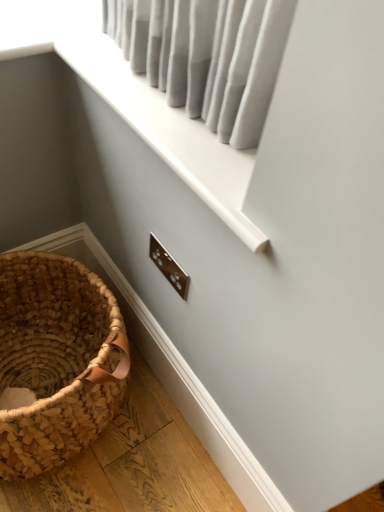
Image resolution: width=384 pixels, height=512 pixels. Describe the element at coordinates (166, 129) in the screenshot. I see `white plastic window frame at upper center` at that location.

Find the location of a particular element. white plastic window frame at upper center is located at coordinates (166, 129).

In order to face white plastic window frame at upper center, should I rotate leftwards or rightwards?

It's best to rotate left around 6.316 degrees.

Measure the distance between point (244,198) and camera.

Point (244,198) is 24.29 inches from camera.

The height and width of the screenshot is (512, 384). Identify the location of brown woven picnic basket at lower left. (56, 359).

In order to face brown woven picnic basket at lower left, should I rotate leftwards or rightwards?

Rotate left and turn 20.461 degrees.

What do you see at coordinates (56, 359) in the screenshot? I see `brown woven picnic basket at lower left` at bounding box center [56, 359].

The width and height of the screenshot is (384, 512). I want to click on white plastic window frame at upper center, so click(x=166, y=129).

Consider the image. Considering the relative positions of brown woven picnic basket at lower left and white plastic window frame at upper center in the image provided, is brown woven picnic basket at lower left to the right of white plastic window frame at upper center from the viewer's perspective?

No, brown woven picnic basket at lower left is not to the right of white plastic window frame at upper center.

Which is behind, brown woven picnic basket at lower left or white plastic window frame at upper center?

brown woven picnic basket at lower left is behind.

Between point (9, 332) and point (201, 168), which one is positioned in front?

The point (201, 168) is closer.

From the image's perspective, which object appears higher, brown woven picnic basket at lower left or white plastic window frame at upper center?

white plastic window frame at upper center, from the image's perspective.

From a real-world perspective, is brown woven picnic basket at lower left physically located above or below white plastic window frame at upper center?

brown woven picnic basket at lower left is below white plastic window frame at upper center.

Can you confirm if brown woven picnic basket at lower left is thinner than white plastic window frame at upper center?

No, brown woven picnic basket at lower left is not thinner than white plastic window frame at upper center.

In terms of height, does brown woven picnic basket at lower left look taller or shorter compared to white plastic window frame at upper center?

In the image, brown woven picnic basket at lower left appears to be taller than white plastic window frame at upper center.

Can you confirm if brown woven picnic basket at lower left is bigger than white plastic window frame at upper center?

Yes, brown woven picnic basket at lower left is bigger than white plastic window frame at upper center.

Would you say brown woven picnic basket at lower left is inside or outside white plastic window frame at upper center?

brown woven picnic basket at lower left exists outside the volume of white plastic window frame at upper center.

From the picture: Is brown woven picnic basket at lower left far from white plastic window frame at upper center?

brown woven picnic basket at lower left is near white plastic window frame at upper center, not far away.

Is brown woven picnic basket at lower left facing towards white plastic window frame at upper center?

No, brown woven picnic basket at lower left is not turned towards white plastic window frame at upper center.

In the scene shown: How different are the orientations of brown woven picnic basket at lower left and white plastic window frame at upper center in degrees?

They differ by 90.5 degrees in their facing directions.

Locate an element on the screen. Image resolution: width=384 pixels, height=512 pixels. picnic basket below the white plastic window frame at upper center (from the image's perspective) is located at coordinates (56, 359).

Which object is positioned more to the right, white plastic window frame at upper center or brown woven picnic basket at lower left?

Positioned to the right is white plastic window frame at upper center.

Based on the photo, between white plastic window frame at upper center and brown woven picnic basket at lower left, which one is positioned behind?

brown woven picnic basket at lower left is further from the camera.

Between point (118, 62) and point (119, 373), which one is positioned behind?

The point (119, 373) is farther.

Based on the photo, from the image's perspective, which object appears higher, white plastic window frame at upper center or brown woven picnic basket at lower left?

white plastic window frame at upper center, from the image's perspective.

From a real-world perspective, is white plastic window frame at upper center positioned above or below brown woven picnic basket at lower left?

Clearly, from a real-world perspective, white plastic window frame at upper center is above brown woven picnic basket at lower left.

Considering the sizes of objects white plastic window frame at upper center and brown woven picnic basket at lower left in the image provided, who is wider, white plastic window frame at upper center or brown woven picnic basket at lower left?

brown woven picnic basket at lower left.

Between white plastic window frame at upper center and brown woven picnic basket at lower left, which one has less height?

With less height is white plastic window frame at upper center.

In the scene shown: In terms of size, does white plastic window frame at upper center appear bigger or smaller than brown woven picnic basket at lower left?

Clearly, white plastic window frame at upper center is smaller in size than brown woven picnic basket at lower left.

Is white plastic window frame at upper center located outside brown woven picnic basket at lower left?

white plastic window frame at upper center is positioned outside brown woven picnic basket at lower left.

Is white plastic window frame at upper center positioned far away from brown woven picnic basket at lower left?

white plastic window frame at upper center is near brown woven picnic basket at lower left, not far away.

From the picture: Is white plastic window frame at upper center oriented towards brown woven picnic basket at lower left?

No, white plastic window frame at upper center is not facing towards brown woven picnic basket at lower left.

How many degrees apart are the facing directions of white plastic window frame at upper center and brown woven picnic basket at lower left?

The angular difference between white plastic window frame at upper center and brown woven picnic basket at lower left is 90.5 degrees.

The image size is (384, 512). Find the location of `picnic basket lying on the left of white plastic window frame at upper center`. picnic basket lying on the left of white plastic window frame at upper center is located at coordinates (56, 359).

In order to click on picnic basket below the white plastic window frame at upper center (from the image's perspective) in this screenshot , I will do `click(56, 359)`.

You are a GUI agent. You are given a task and a screenshot of the screen. Output one action in this format:
    pyautogui.click(x=<x>, y=<y>)
    Task: Click on the window frame above the brown woven picnic basket at lower left (from a real-world perspective)
    This screenshot has width=384, height=512.
    Given the screenshot: What is the action you would take?
    pyautogui.click(x=166, y=129)